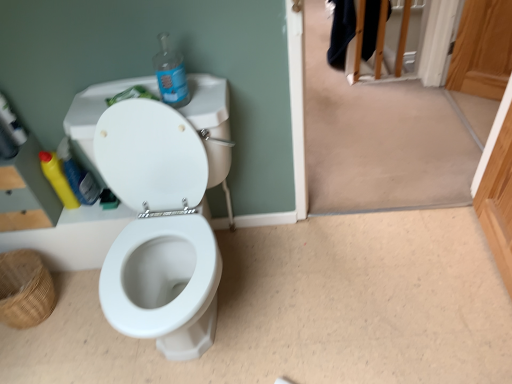
Question: Are transparent plastic bottle at upper center, arranged as the 3th bottle when viewed from the back, and brown woven basket at lower left far apart?

Choices:
 (A) no
 (B) yes

Answer: (A)

Question: Can you see transparent plastic bottle at upper center, positioned as the first bottle in front-to-back order, touching brown woven basket at lower left?

Choices:
 (A) no
 (B) yes

Answer: (A)

Question: Can you confirm if transparent plastic bottle at upper center, which is the third bottle from left to right, is wider than brown woven basket at lower left?

Choices:
 (A) yes
 (B) no

Answer: (B)

Question: Can you confirm if transparent plastic bottle at upper center, positioned as the first bottle in front-to-back order, is thinner than brown woven basket at lower left?

Choices:
 (A) yes
 (B) no

Answer: (A)

Question: Is transparent plastic bottle at upper center, arranged as the 1th bottle when viewed from the right, oriented towards brown woven basket at lower left?

Choices:
 (A) no
 (B) yes

Answer: (A)

Question: Visually, is yellow plastic bottle at left, which ranks as the second bottle in right-to-left order, positioned to the left or to the right of white glossy toilet at center?

Choices:
 (A) right
 (B) left

Answer: (B)

Question: Considering the positions of point (56, 150) and point (140, 230), is point (56, 150) closer or farther from the camera than point (140, 230)?

Choices:
 (A) closer
 (B) farther

Answer: (B)

Question: Is yellow plastic bottle at left, which ranks as the second bottle in right-to-left order, inside the boundaries of white glossy toilet at center, or outside?

Choices:
 (A) inside
 (B) outside

Answer: (B)

Question: Is yellow plastic bottle at left, the second bottle in the back-to-front sequence, bigger or smaller than white glossy toilet at center?

Choices:
 (A) big
 (B) small

Answer: (B)

Question: In the image, is brown woven basket at lower left on the left side or the right side of white glossy toilet at center?

Choices:
 (A) left
 (B) right

Answer: (A)

Question: Is brown woven basket at lower left taller or shorter than white glossy toilet at center?

Choices:
 (A) tall
 (B) short

Answer: (B)

Question: From a real-world perspective, is brown woven basket at lower left physically located above or below white glossy toilet at center?

Choices:
 (A) below
 (B) above

Answer: (A)

Question: Relative to white glossy toilet at center, is brown woven basket at lower left in front or behind?

Choices:
 (A) behind
 (B) front

Answer: (A)

Question: From a real-world perspective, is yellow plastic bottle at left, which ranks as the second bottle in right-to-left order, positioned above or below brown woven basket at lower left?

Choices:
 (A) below
 (B) above

Answer: (B)

Question: Which is correct: yellow plastic bottle at left, acting as the second bottle starting from the left, is inside brown woven basket at lower left, or outside of it?

Choices:
 (A) outside
 (B) inside

Answer: (A)